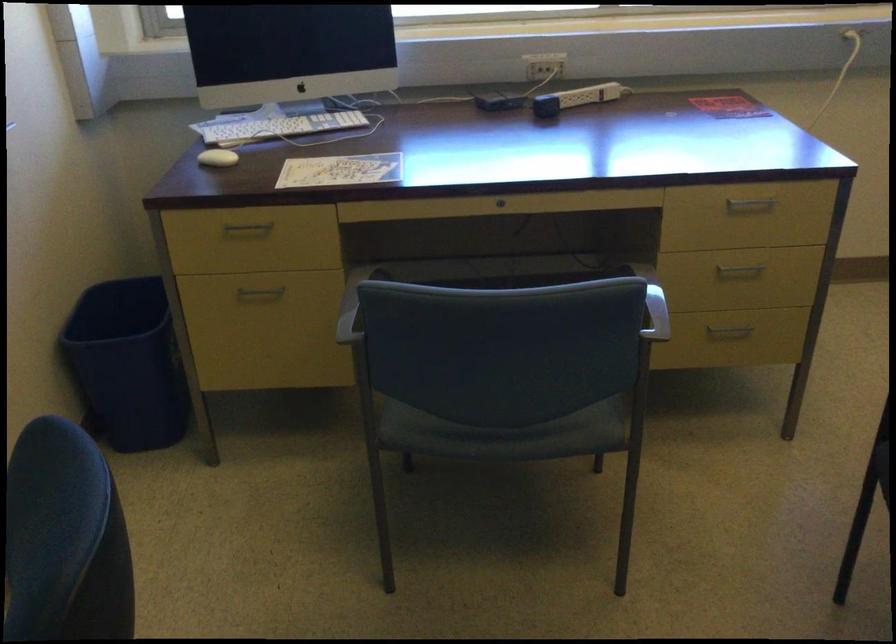
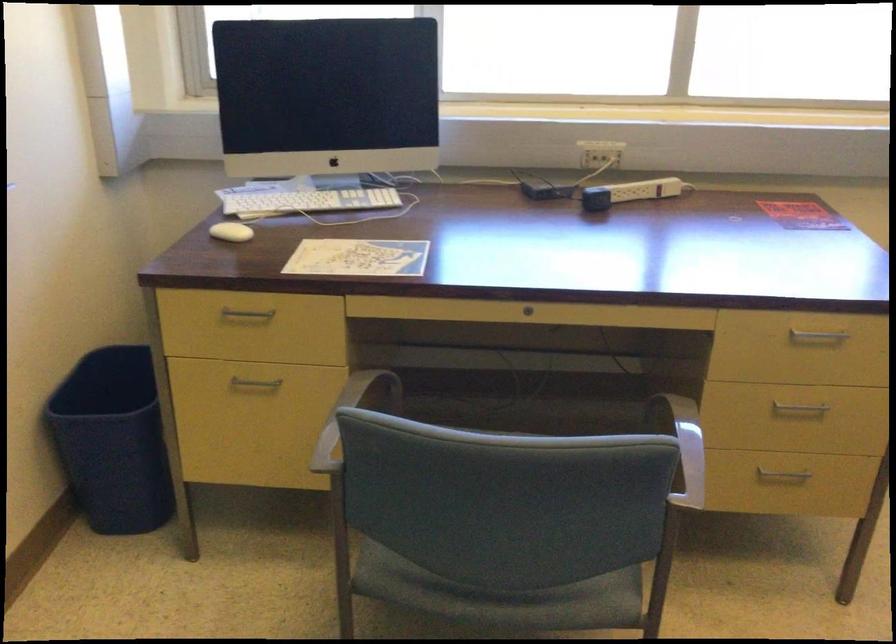
Where in the second image is the point corresponding to point (739, 269) from the first image?

(798, 408)